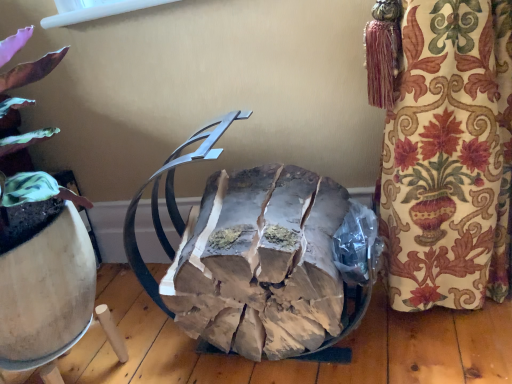
Question: In the image, is natural wood logs at center positioned in front of or behind white plastic window screen at upper center?

Choices:
 (A) behind
 (B) front

Answer: (B)

Question: From the image's perspective, relative to white plastic window screen at upper center, is natural wood logs at center above or below?

Choices:
 (A) below
 (B) above

Answer: (A)

Question: From a real-world perspective, is natural wood logs at center positioned above or below white plastic window screen at upper center?

Choices:
 (A) below
 (B) above

Answer: (A)

Question: From the image's perspective, is white plastic window screen at upper center above or below natural wood logs at center?

Choices:
 (A) above
 (B) below

Answer: (A)

Question: Based on their positions, is white plastic window screen at upper center located to the left or right of natural wood logs at center?

Choices:
 (A) left
 (B) right

Answer: (A)

Question: Considering the positions of point (92, 6) and point (260, 304), is point (92, 6) closer or farther from the camera than point (260, 304)?

Choices:
 (A) farther
 (B) closer

Answer: (A)

Question: Is white plastic window screen at upper center in front of or behind natural wood logs at center in the image?

Choices:
 (A) front
 (B) behind

Answer: (B)